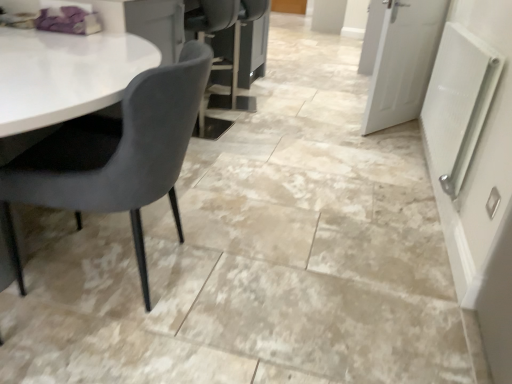
Question: Does white textured radiator at right have a larger size compared to white matte door at upper right, acting as the 2th door starting from the back?

Choices:
 (A) yes
 (B) no

Answer: (B)

Question: Considering the relative positions of white textured radiator at right and white matte door at upper right, positioned as the second door in top-to-bottom order, in the image provided, is white textured radiator at right to the left of white matte door at upper right, positioned as the second door in top-to-bottom order, from the viewer's perspective?

Choices:
 (A) no
 (B) yes

Answer: (B)

Question: Are white textured radiator at right and white matte door at upper right, positioned as the second door in top-to-bottom order, located far from each other?

Choices:
 (A) yes
 (B) no

Answer: (B)

Question: Is white textured radiator at right facing towards white matte door at upper right, positioned as the second door in top-to-bottom order?

Choices:
 (A) yes
 (B) no

Answer: (B)

Question: Considering the relative sizes of white textured radiator at right and white matte door at upper right, positioned as the second door in top-to-bottom order, in the image provided, is white textured radiator at right wider than white matte door at upper right, positioned as the second door in top-to-bottom order,?

Choices:
 (A) yes
 (B) no

Answer: (B)

Question: From a real-world perspective, is white textured radiator at right below white matte door at upper right, which ranks as the first door in bottom-to-top order?

Choices:
 (A) yes
 (B) no

Answer: (B)

Question: Is white textured radiator at right far away from velvet grey chair at left?

Choices:
 (A) yes
 (B) no

Answer: (A)

Question: Can you confirm if white textured radiator at right is positioned to the right of velvet grey chair at left?

Choices:
 (A) no
 (B) yes

Answer: (B)

Question: Is the position of white textured radiator at right less distant than that of velvet grey chair at left?

Choices:
 (A) yes
 (B) no

Answer: (B)

Question: Can you confirm if white textured radiator at right is shorter than velvet grey chair at left?

Choices:
 (A) no
 (B) yes

Answer: (B)

Question: Can you confirm if white textured radiator at right is wider than velvet grey chair at left?

Choices:
 (A) yes
 (B) no

Answer: (B)

Question: Is white textured radiator at right touching velvet grey chair at left?

Choices:
 (A) yes
 (B) no

Answer: (B)

Question: Considering the relative positions of velvet grey chair at left and white matte door at upper right, the 1th door positioned from the front, in the image provided, is velvet grey chair at left to the left of white matte door at upper right, the 1th door positioned from the front, from the viewer's perspective?

Choices:
 (A) no
 (B) yes

Answer: (B)